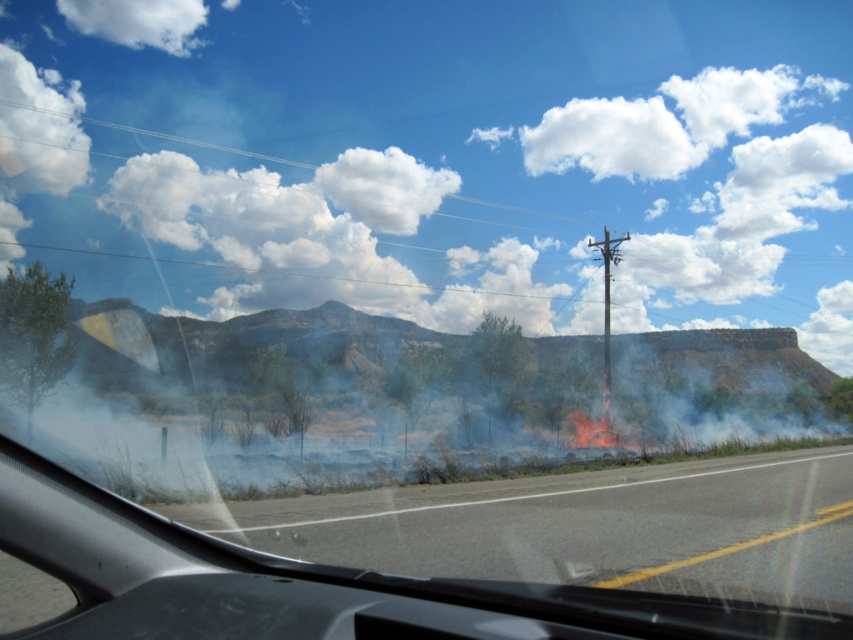
Question: Which point is closer to the camera?

Choices:
 (A) (607, 376)
 (B) (703, 541)

Answer: (B)

Question: Observing the image, what is the correct spatial positioning of smooth asphalt highway at center in reference to metallic gray telegraph pole at right?

Choices:
 (A) below
 (B) above

Answer: (A)

Question: Which object appears farthest from the camera in this image?

Choices:
 (A) metallic gray telegraph pole at right
 (B) smooth asphalt highway at center

Answer: (A)

Question: Is smooth asphalt highway at center to the left of metallic gray telegraph pole at right from the viewer's perspective?

Choices:
 (A) yes
 (B) no

Answer: (A)

Question: Where is smooth asphalt highway at center located in relation to metallic gray telegraph pole at right in the image?

Choices:
 (A) right
 (B) left

Answer: (B)